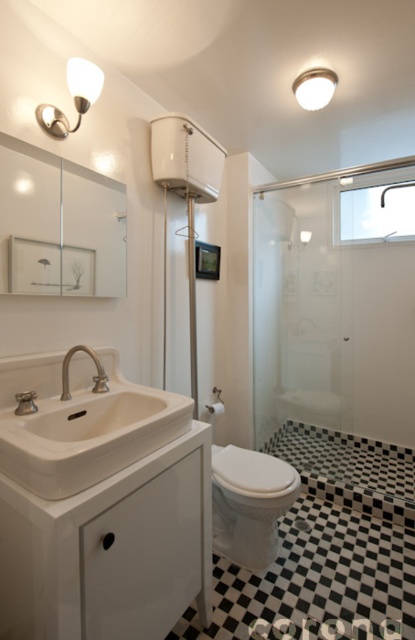
Is matte white sconce at upper left behind brushed nickel faucet at sink left?

Yes, it is.

Is matte white sconce at upper left to the left of brushed nickel faucet at sink left from the viewer's perspective?

Indeed, matte white sconce at upper left is positioned on the left side of brushed nickel faucet at sink left.

Is point (90, 70) positioned in front of point (66, 365)?

No, (90, 70) is further to viewer.

Identify the location of matte white sconce at upper left. (73, 97).

Does transparent glass shower door at center appear over brushed nickel faucet at sink left?

Indeed, transparent glass shower door at center is positioned over brushed nickel faucet at sink left.

Which is behind, point (361, 394) or point (102, 381)?

Point (361, 394)

Find the location of a particular element. This screenshot has width=415, height=640. transparent glass shower door at center is located at coordinates (378, 305).

Is point (44, 371) behind point (68, 387)?

No, (44, 371) is closer to viewer.

Between white ceramic sink at lower left and brushed nickel faucet at sink left, which one has more height?

Standing taller between the two is white ceramic sink at lower left.

Who is more distant from viewer, (170, 435) or (61, 394)?

Positioned behind is point (61, 394).

At what (x,y) coordinates should I click in order to perform the action: click on white ceramic sink at lower left. Please return your answer as a coordinate pair (x, y). Looking at the image, I should click on (80, 422).